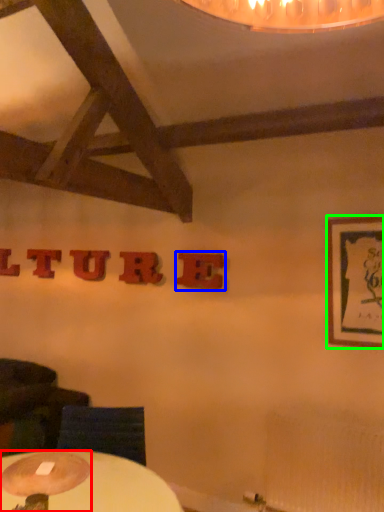
Question: Which is farther away from table lamp (highlighted by a red box)? letter (highlighted by a blue box) or picture frame (highlighted by a green box)?

Choices:
 (A) letter
 (B) picture frame

Answer: (B)